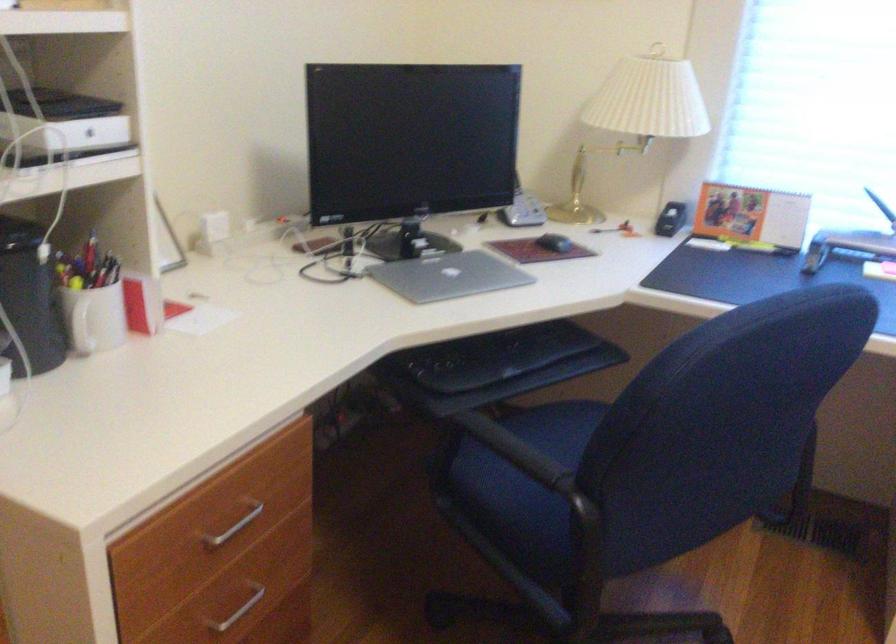
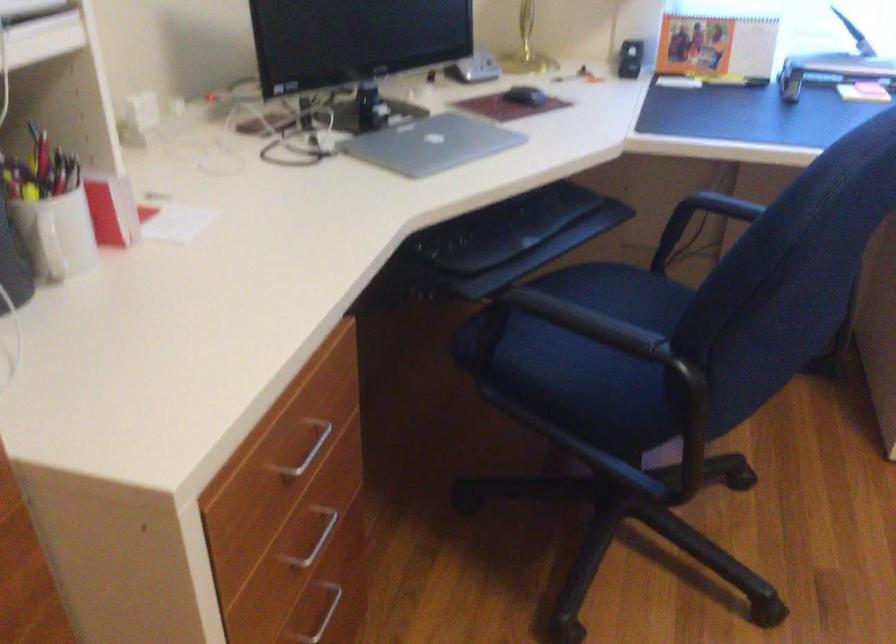
Question: Based on the continuous images, in which direction is the camera rotating? Reply with the corresponding letter.

Choices:
 (A) Left
 (B) Right
 (C) Up
 (D) Down

Answer: (D)